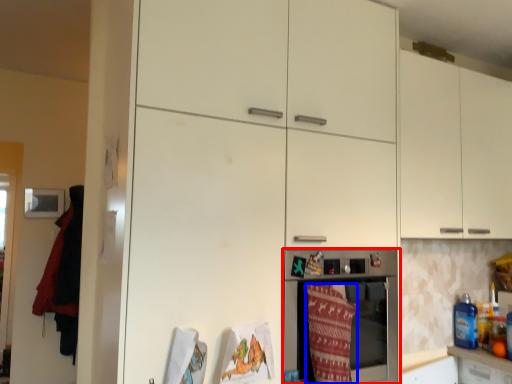
Question: Which of the following is the farthest to the observer, home appliance (highlighted by a red box) or blanket (highlighted by a blue box)?

Choices:
 (A) home appliance
 (B) blanket

Answer: (A)